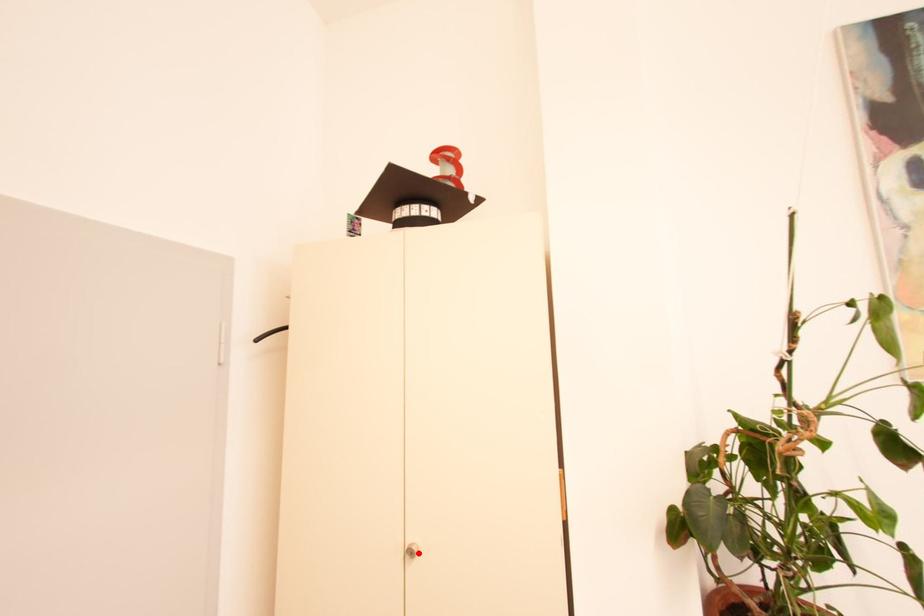
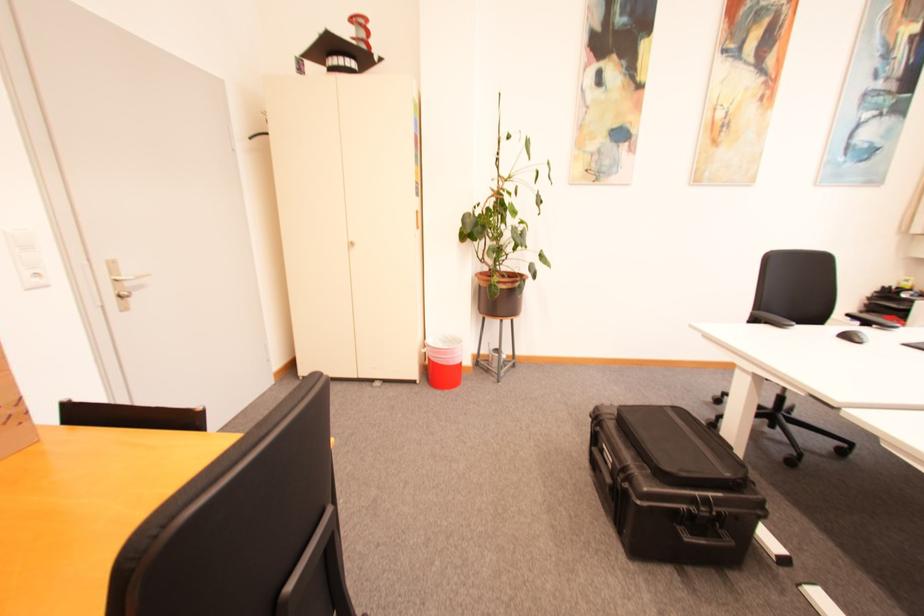
In the second image, find the point that corresponds to the highlighted location in the first image.

(359, 245)